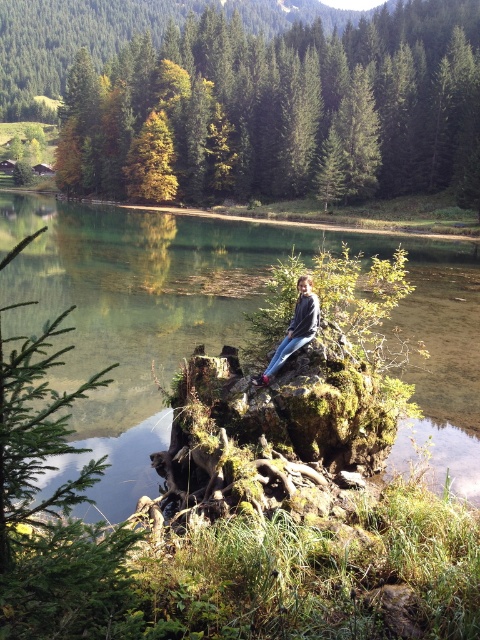
Between green matte tree at center and blue jeans at center, which one has less height?

blue jeans at center

Which is behind, point (432, 60) or point (271, 369)?

Point (432, 60)

At what (x,y) coordinates should I click in order to perform the action: click on green matte tree at center. Please return your answer as a coordinate pair (x, y). Image resolution: width=480 pixels, height=640 pixels. Looking at the image, I should click on (287, 108).

Is point (3, 328) positioned behind point (315, 296)?

Yes, point (3, 328) is farther from viewer.

Between point (233, 221) and point (294, 337), which one is positioned in front?

Point (294, 337)

Which is behind, point (118, 516) or point (284, 360)?

Point (284, 360)

Where is `clear water at center`? This screenshot has width=480, height=640. clear water at center is located at coordinates (216, 324).

Between clear water at center and green matte tree at center, which one has less height?

clear water at center

Consider the image. Who is higher up, clear water at center or green matte tree at center?

green matte tree at center is higher up.

Which is in front, point (155, 440) or point (467, 22)?

Point (155, 440)

The width and height of the screenshot is (480, 640). Identify the location of clear water at center. (216, 324).